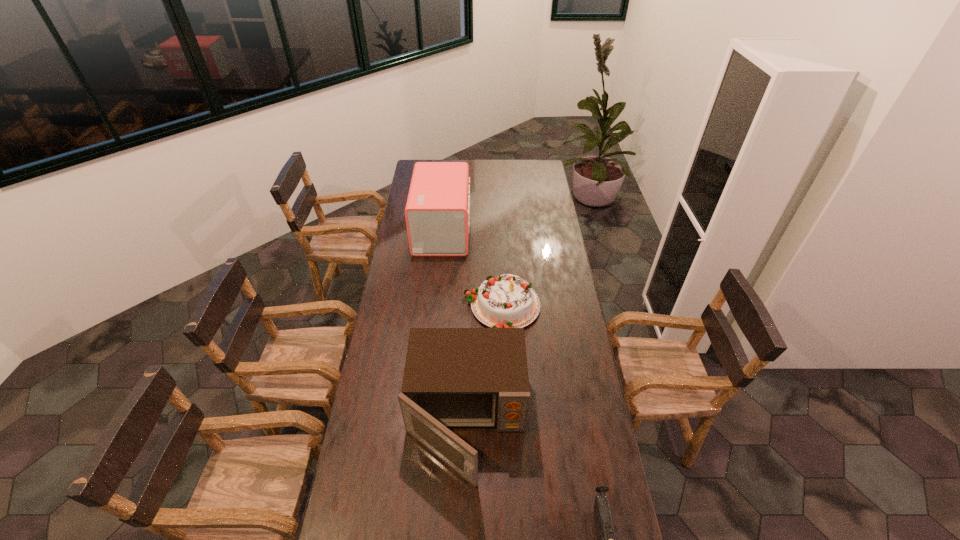
Image resolution: width=960 pixels, height=540 pixels. I want to click on object that is at the right edge, so [x=507, y=301].

Where is `vacant area at the far edge of the desktop`? The image size is (960, 540). vacant area at the far edge of the desktop is located at coordinates (516, 165).

This screenshot has width=960, height=540. Find the location of `free spot at the left edge of the desktop`. free spot at the left edge of the desktop is located at coordinates (395, 340).

The height and width of the screenshot is (540, 960). I want to click on free location at the right edge of the desktop, so click(x=563, y=451).

Image resolution: width=960 pixels, height=540 pixels. I want to click on free point at the far right corner, so click(x=531, y=167).

Find the location of `free space between the second tallest object and the farthest object`. free space between the second tallest object and the farthest object is located at coordinates [454, 326].

Where is `vacant point located between the tallest object and the second tallest object`? Image resolution: width=960 pixels, height=540 pixels. vacant point located between the tallest object and the second tallest object is located at coordinates (454, 326).

At what (x,y) coordinates should I click in order to perform the action: click on free space that is in between the second shortest object and the tallest object. Please return your answer as a coordinate pair (x, y). Looking at the image, I should click on pos(472,268).

Identify which object is the nearest to the shortest object. Please provide its 2D coordinates. Your answer should be formatted as a tuple, i.e. [(x, y)], where the tuple contains the x and y coordinates of a point satisfying the conditions above.

[(453, 377)]

Find the location of `the third closest object relative to the rightmost object`. the third closest object relative to the rightmost object is located at coordinates pyautogui.click(x=437, y=213).